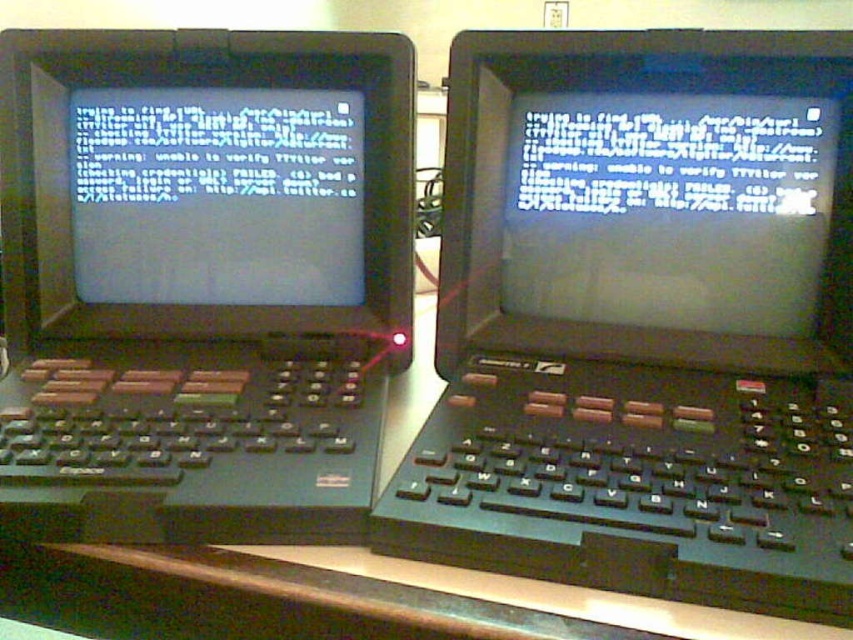
You are trying to reach the wooden table at center to place a book. However, there is a black plastic laptop at center in your way. Can you move the laptop to access the table?

The black plastic laptop at center is in front of the wooden table at center, so you can move the laptop to access the table.